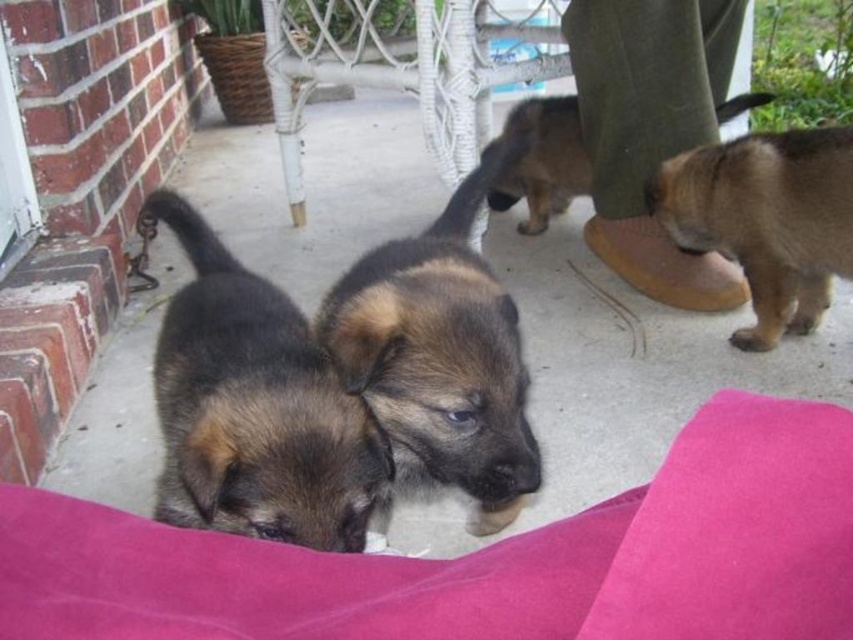
Can you confirm if brown fuzzy puppy at lower left is smaller than brown fur puppy at center?

Yes, brown fuzzy puppy at lower left is smaller than brown fur puppy at center.

Describe the element at coordinates (254, 406) in the screenshot. Image resolution: width=853 pixels, height=640 pixels. I see `brown fuzzy puppy at lower left` at that location.

The width and height of the screenshot is (853, 640). Identify the location of brown fuzzy puppy at lower left. (254, 406).

Is point (822, 160) behind point (569, 141)?

No, (822, 160) is in front of (569, 141).

Who is more distant from viewer, (679, 164) or (547, 182)?

Point (547, 182)

Is point (816, 186) less distant than point (558, 124)?

That is True.

The image size is (853, 640). What are the coordinates of `brown fuzzy dog at right` in the screenshot? It's located at (766, 220).

Can you confirm if brown fur puppy at center is smaller than brown fuzzy dog at center?

Incorrect, brown fur puppy at center is not smaller in size than brown fuzzy dog at center.

Is point (437, 440) farther from camera compared to point (511, 188)?

No, (437, 440) is in front of (511, 188).

At what (x,y) coordinates should I click in order to perform the action: click on brown fur puppy at center. Please return your answer as a coordinate pair (x, y). This screenshot has height=640, width=853. Looking at the image, I should click on (440, 355).